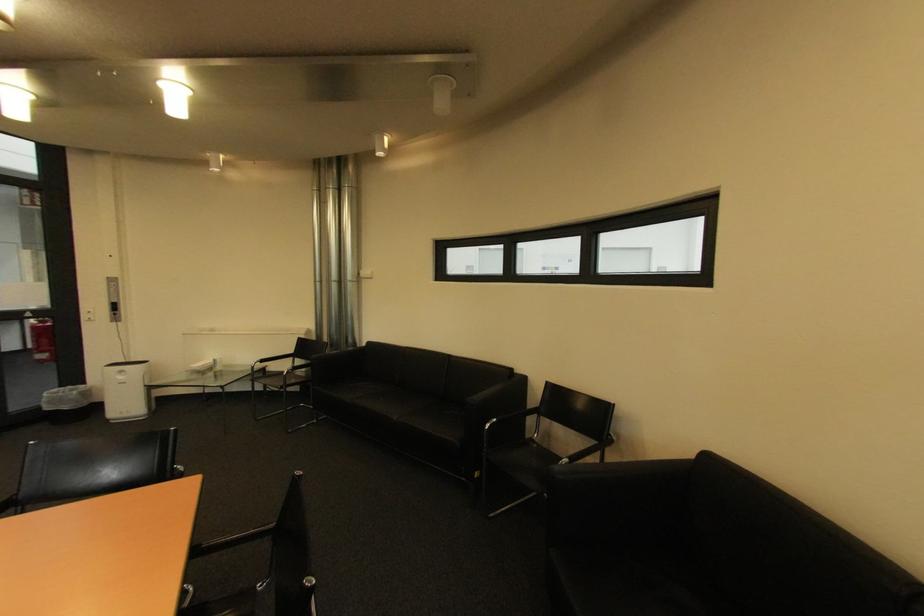
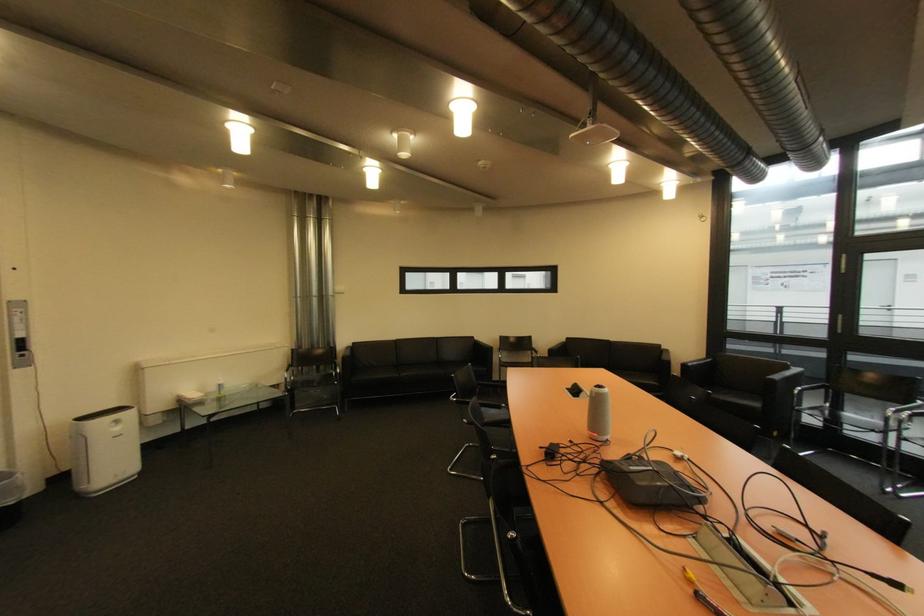
Where in the second image is the point corresponding to (308,339) from the first image?

(301, 352)